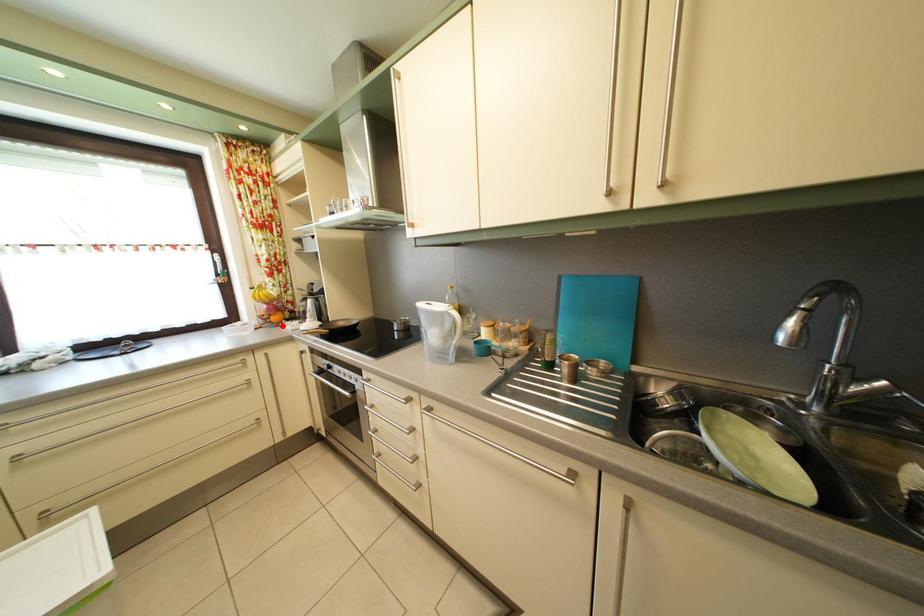
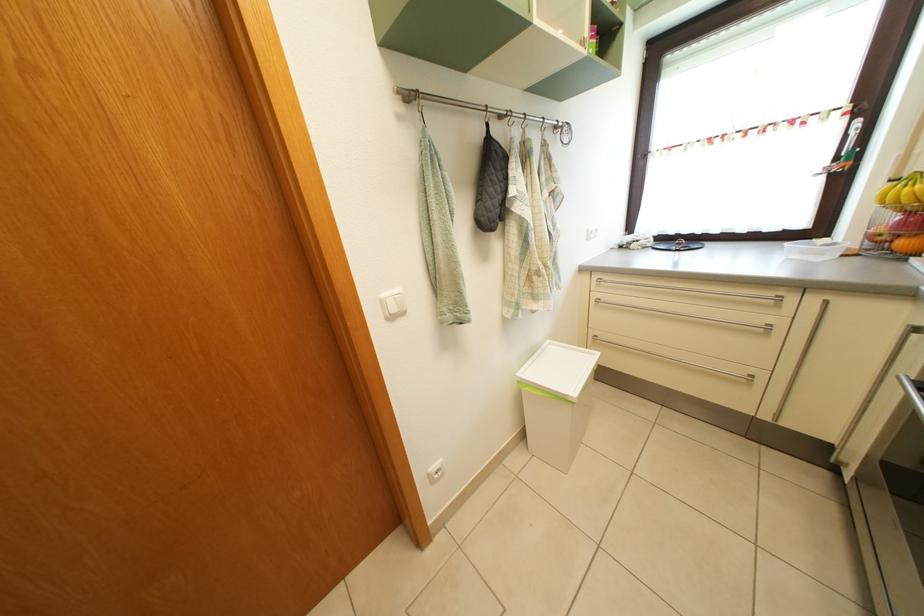
Find the pixel in the second image that matches the highlighted location in the first image.

(910, 252)